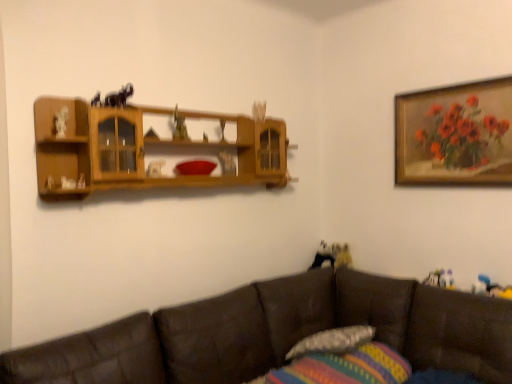
Question: Is striped fabric pillow at lower center, the 2th pillow viewed from the top, at the back of wooden framed painting of flowers at upper right?

Choices:
 (A) no
 (B) yes

Answer: (A)

Question: Considering the relative sizes of wooden framed painting of flowers at upper right and striped fabric pillow at lower center, which ranks as the 1th pillow in bottom-to-top order, in the image provided, is wooden framed painting of flowers at upper right smaller than striped fabric pillow at lower center, which ranks as the 1th pillow in bottom-to-top order,?

Choices:
 (A) no
 (B) yes

Answer: (B)

Question: Is wooden framed painting of flowers at upper right bigger than striped fabric pillow at lower center, the 2th pillow viewed from the top?

Choices:
 (A) no
 (B) yes

Answer: (A)

Question: Considering the relative sizes of wooden framed painting of flowers at upper right and striped fabric pillow at lower center, the 2th pillow viewed from the top, in the image provided, is wooden framed painting of flowers at upper right taller than striped fabric pillow at lower center, the 2th pillow viewed from the top,?

Choices:
 (A) no
 (B) yes

Answer: (B)

Question: Is wooden framed painting of flowers at upper right at the right side of striped fabric pillow at lower center, which ranks as the 1th pillow in bottom-to-top order?

Choices:
 (A) yes
 (B) no

Answer: (A)

Question: From the image's perspective, is textured fabric pillow at lower center, which is the second pillow from bottom to top, located above or below brown leather couch at lower right?

Choices:
 (A) below
 (B) above

Answer: (B)

Question: Is textured fabric pillow at lower center, which appears as the 1th pillow when viewed from the top, in front of or behind brown leather couch at lower right in the image?

Choices:
 (A) behind
 (B) front

Answer: (A)

Question: Looking at the image, does textured fabric pillow at lower center, which is the second pillow from bottom to top, seem bigger or smaller compared to brown leather couch at lower right?

Choices:
 (A) big
 (B) small

Answer: (B)

Question: Based on their positions, is textured fabric pillow at lower center, which appears as the 1th pillow when viewed from the top, located to the left or right of brown leather couch at lower right?

Choices:
 (A) left
 (B) right

Answer: (B)

Question: Based on their sizes in the image, would you say wooden framed painting of flowers at upper right is bigger or smaller than wooden shelf at upper center?

Choices:
 (A) small
 (B) big

Answer: (A)

Question: In terms of height, does wooden framed painting of flowers at upper right look taller or shorter compared to wooden shelf at upper center?

Choices:
 (A) tall
 (B) short

Answer: (A)

Question: Considering their positions, is wooden framed painting of flowers at upper right located in front of or behind wooden shelf at upper center?

Choices:
 (A) behind
 (B) front

Answer: (A)

Question: From a real-world perspective, is wooden framed painting of flowers at upper right positioned above or below wooden shelf at upper center?

Choices:
 (A) below
 (B) above

Answer: (B)

Question: Is textured fabric pillow at lower center, which is the second pillow from bottom to top, in front of or behind wooden framed painting of flowers at upper right in the image?

Choices:
 (A) behind
 (B) front

Answer: (B)

Question: Considering the positions of point (358, 324) and point (495, 99), is point (358, 324) closer or farther from the camera than point (495, 99)?

Choices:
 (A) closer
 (B) farther

Answer: (B)